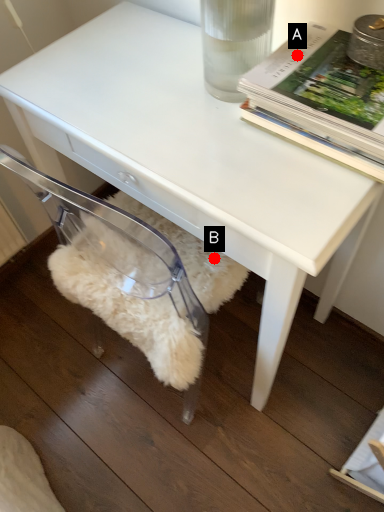
Question: Two points are circled on the image, labeled by A and B beside each circle. Which point is further to the camera?

Choices:
 (A) A is further
 (B) B is further

Answer: (B)